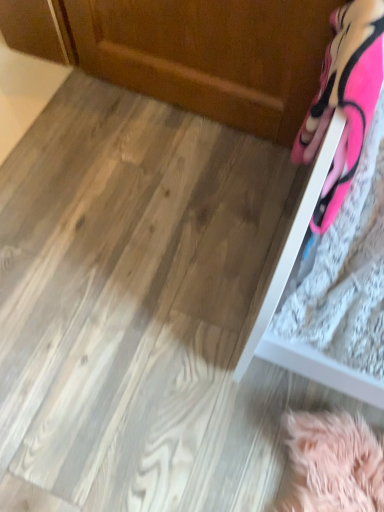
Image resolution: width=384 pixels, height=512 pixels. Describe the element at coordinates (329, 141) in the screenshot. I see `pink fabric bed at right` at that location.

The width and height of the screenshot is (384, 512). In order to click on pink fabric bed at right in this screenshot , I will do (329, 141).

In the scene shown: Measure the distance between pink fabric bed at right and camera.

pink fabric bed at right is 22.01 inches from camera.

I want to click on pink fabric bed at right, so click(x=329, y=141).